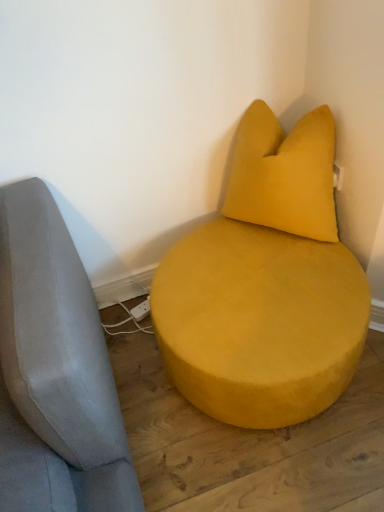
Image resolution: width=384 pixels, height=512 pixels. Identify the location of empty space that is ontop of suede yellow ottoman at center (from a real-world perspective). (253, 273).